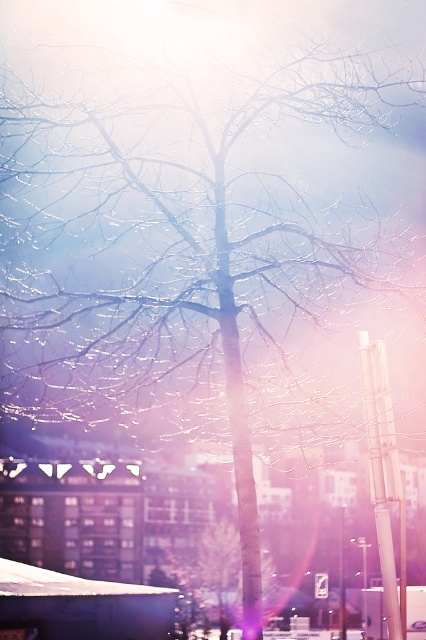
Is white glossy pole at right thinner than smooth bark tree at center?

Yes, white glossy pole at right is thinner than smooth bark tree at center.

Is point (362, 371) farther from viewer compared to point (265, 557)?

No, it is not.

Measure the distance between point (382,522) and camera.

Point (382,522) and camera are 8.20 meters apart.

Find the location of a particular element. This screenshot has width=426, height=640. white glossy pole at right is located at coordinates (382, 467).